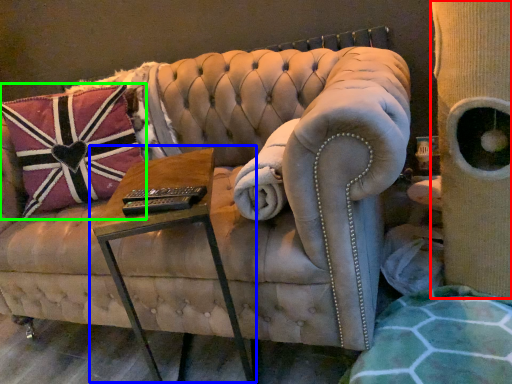
Question: Considering the real-world distances, which object is farthest from side (highlighted by a red box)? table (highlighted by a blue box) or pillow (highlighted by a green box)?

Choices:
 (A) table
 (B) pillow

Answer: (B)